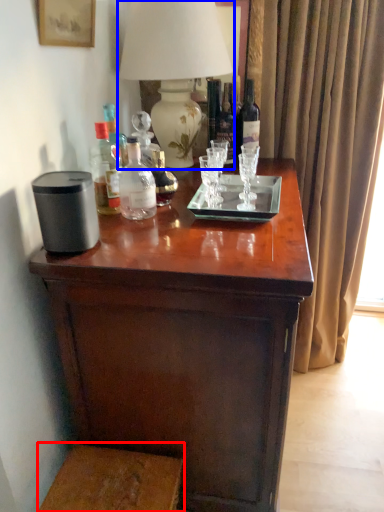
Question: Among these objects, which one is farthest to the camera, step stool (highlighted by a red box) or table lamp (highlighted by a blue box)?

Choices:
 (A) step stool
 (B) table lamp

Answer: (B)